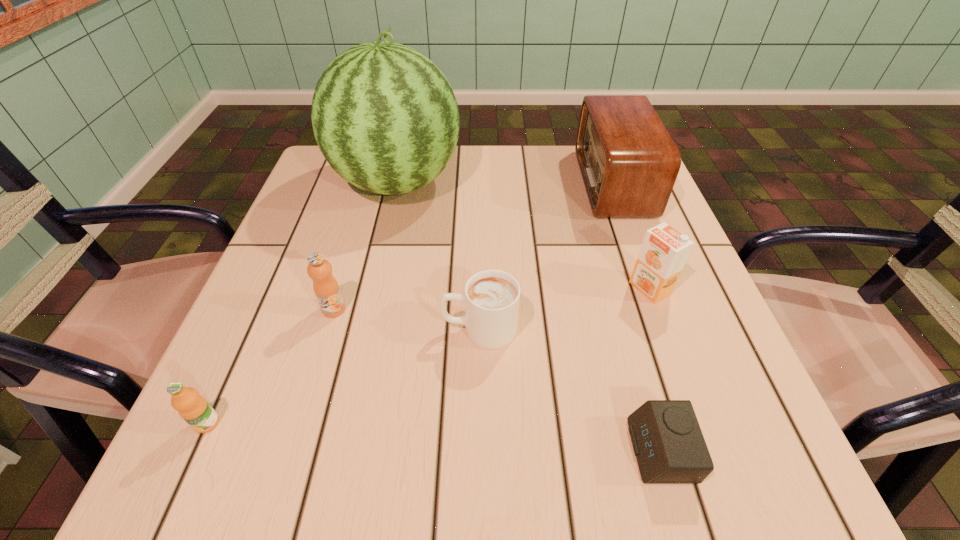
You are a GUI agent. You are given a task and a screenshot of the screen. Output one action in this format:
    pyautogui.click(x=<x>, y=<y>)
    Task: Click on the orange juice that is the second closest to the rightmost orange juice
    This screenshot has height=540, width=960.
    Given the screenshot: What is the action you would take?
    pyautogui.click(x=193, y=408)

Identify the location of vacant space that satisfies the following two spatial constraints: 1. on the front panel of the radio receiver; 2. on the front side of the rightmost orange juice. The width and height of the screenshot is (960, 540). (652, 288).

This screenshot has height=540, width=960. Identify the location of vacant space that satisfies the following two spatial constraints: 1. on the side with the handle of the cappuccino; 2. on the label of the shortest orange juice. (479, 423).